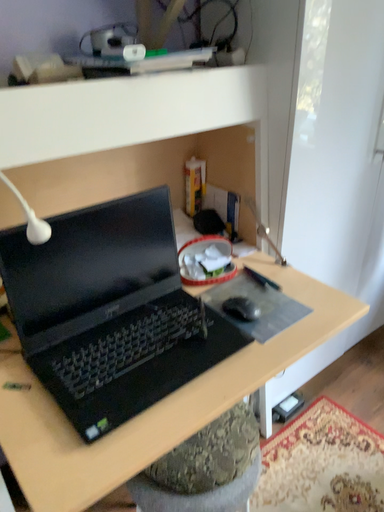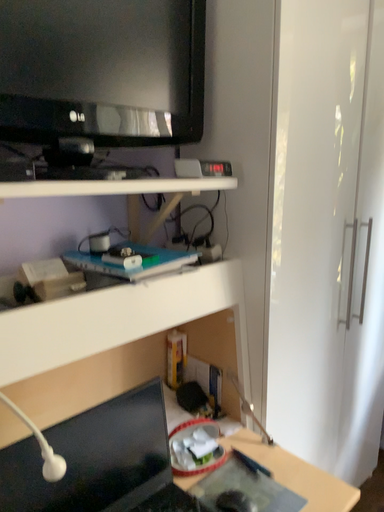
Question: Which way did the camera rotate in the video?

Choices:
 (A) rotated downward
 (B) rotated upward

Answer: (B)